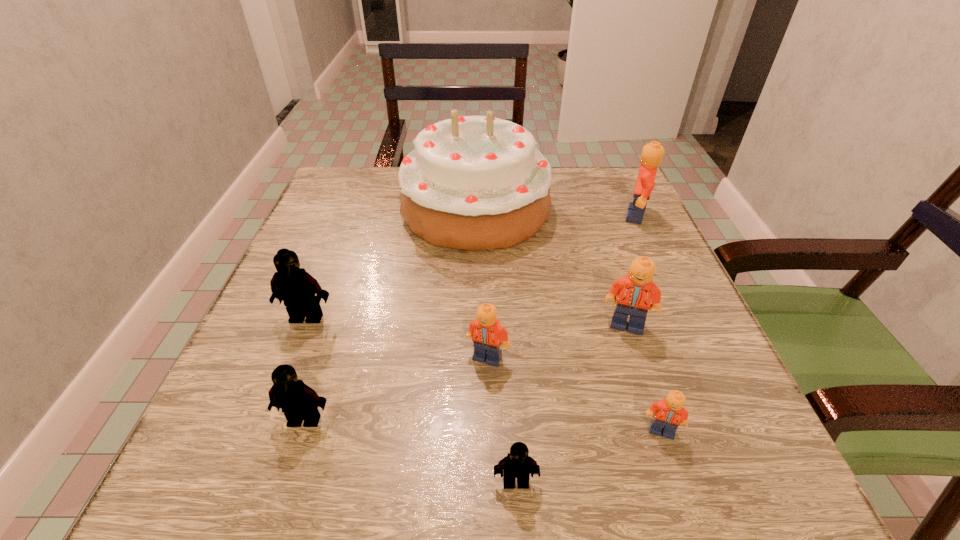
You are a GUI agent. You are given a task and a screenshot of the screen. Output one action in this format:
    pyautogui.click(x=<x>, y=<y>)
    Task: Click on the object that is the sixth closest to the second nearest orange Lego
    This screenshot has height=540, width=960.
    Given the screenshot: What is the action you would take?
    pyautogui.click(x=475, y=183)

The width and height of the screenshot is (960, 540). Identify the location of object that is the seventh closest to the second biggest orange Lego. (291, 284).

Point out which Lego is positioned as the second nearest to the farthest Lego. Please provide its 2D coordinates. Your answer should be formatted as a tuple, i.e. [(x, y)], where the tuple contains the x and y coordinates of a point satisfying the conditions above.

[(486, 332)]

Identify the location of Lego identified as the third closest to the red cake. The image size is (960, 540). (635, 292).

Locate which orange Lego ranks second in proximity to the farthest black Lego. Please provide its 2D coordinates. Your answer should be formatted as a tuple, i.e. [(x, y)], where the tuple contains the x and y coordinates of a point satisfying the conditions above.

[(635, 292)]

The height and width of the screenshot is (540, 960). Find the location of `orange Lego that is the nearest to the third smallest orange Lego`. orange Lego that is the nearest to the third smallest orange Lego is located at coordinates (669, 413).

Identify the location of the second closest black Lego to the leftmost orange Lego. The height and width of the screenshot is (540, 960). (299, 402).

The image size is (960, 540). What are the coordinates of `black Lego identified as the second closest to the tallest Lego` in the screenshot? It's located at (291, 284).

At what (x,y) coordinates should I click in order to perform the action: click on free spot that satisfies the following two spatial constraints: 1. on the front-facing side of the rightmost Lego; 2. on the front-facing side of the second farthest orange Lego. Please return your answer as a coordinate pair (x, y). Looking at the image, I should click on (686, 325).